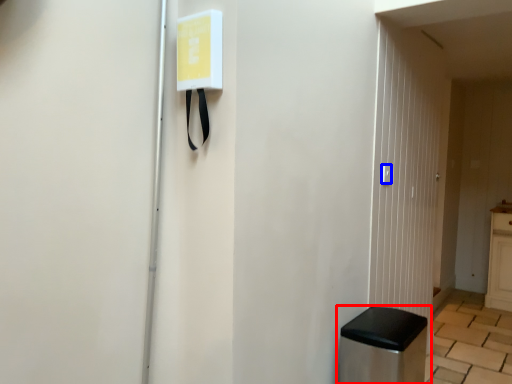
Question: Which point is closer to the camera, furniture (highlighted by a red box) or light switch (highlighted by a blue box)?

Choices:
 (A) furniture
 (B) light switch

Answer: (A)